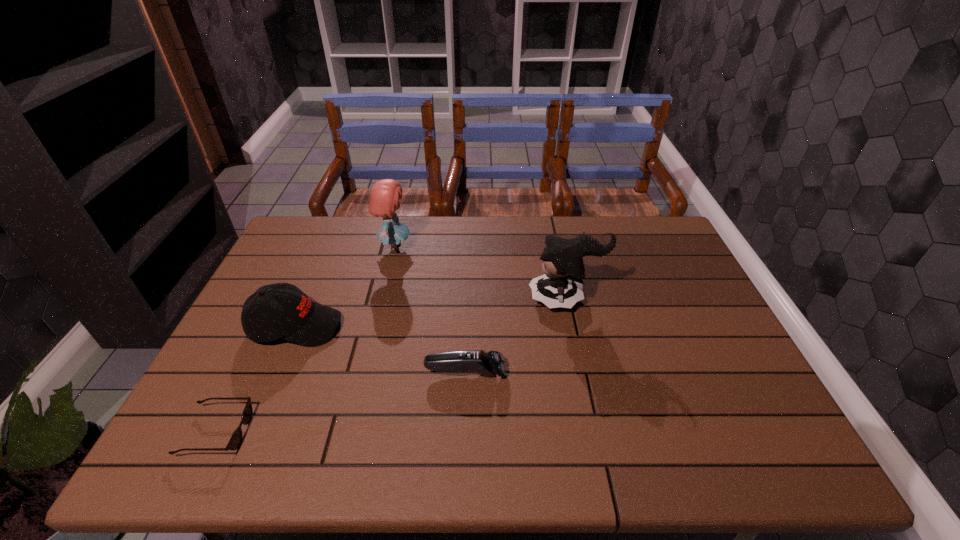
Where is `the third object from left to right`? The width and height of the screenshot is (960, 540). the third object from left to right is located at coordinates point(384,198).

At what (x,y) coordinates should I click in order to perform the action: click on the left doll. Please return your answer as a coordinate pair (x, y). Looking at the image, I should click on (384, 198).

Where is `the nearer doll`? the nearer doll is located at coordinates (561, 286).

Identify the location of the rightmost object. This screenshot has width=960, height=540. (561, 286).

Image resolution: width=960 pixels, height=540 pixels. Identify the location of the third tallest object. (302, 321).

Identify the location of the second shortest object. (489, 364).

Where is `the second object from right to left`? Image resolution: width=960 pixels, height=540 pixels. the second object from right to left is located at coordinates (489, 364).

Image resolution: width=960 pixels, height=540 pixels. Identify the location of the shortest object. (236, 438).

This screenshot has height=540, width=960. Find the location of `the nearest object`. the nearest object is located at coordinates click(x=236, y=438).

Identify the location of vacant area situated on the front-facing side of the farthest object. Image resolution: width=960 pixels, height=540 pixels. (520, 247).